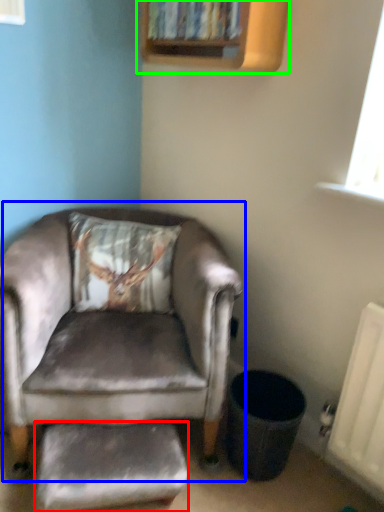
Question: Estimate the real-world distances between objects in this image. Which object is closer to footrest (highlighted by a red box), chair (highlighted by a blue box) or bookshelf (highlighted by a green box)?

Choices:
 (A) chair
 (B) bookshelf

Answer: (A)